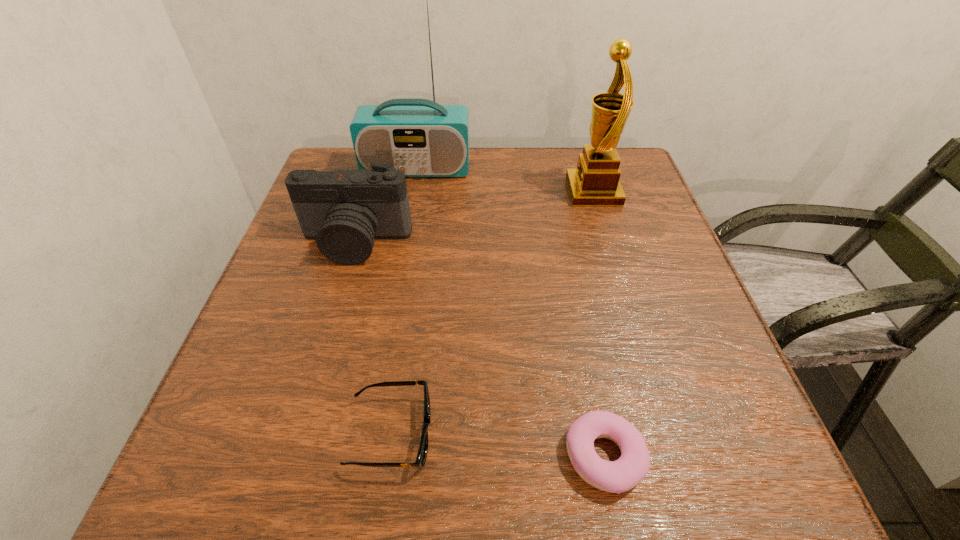
You are a GUI agent. You are given a task and a screenshot of the screen. Output one action in this format:
    pyautogui.click(x=<x>, y=<y>)
    Task: Click on the radio receiver
    Image resolution: width=960 pixels, height=540 pixels.
    Given the screenshot: What is the action you would take?
    pyautogui.click(x=422, y=138)

Image resolution: width=960 pixels, height=540 pixels. Find the location of `the second tallest object`. the second tallest object is located at coordinates (595, 182).

Identify the location of the third farthest object. The image size is (960, 540). (344, 210).

Find the location of a particular element. The height and width of the screenshot is (540, 960). the third shortest object is located at coordinates (344, 210).

Where is `sunglasses`? Image resolution: width=960 pixels, height=540 pixels. sunglasses is located at coordinates (421, 457).

Locate an element on the screen. pastry is located at coordinates (618, 476).

Find the location of a particular element. This screenshot has width=960, height=540. free space located 0.350m on the front panel of the tallest object is located at coordinates (396, 283).

Locate an element on the screen. The image size is (960, 540). vacant space positioned 0.350m on the front-facing side of the second tallest object is located at coordinates (425, 192).

Locate an element on the screen. free spot located 0.360m on the front-facing side of the second tallest object is located at coordinates (420, 192).

Locate an element on the screen. vacant space located 0.240m on the front-facing side of the second tallest object is located at coordinates (470, 192).